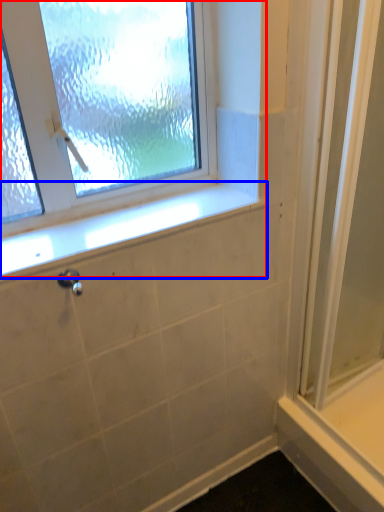
Question: Which object appears farthest to the camera in this image, window (highlighted by a red box) or window sill (highlighted by a blue box)?

Choices:
 (A) window
 (B) window sill

Answer: (B)